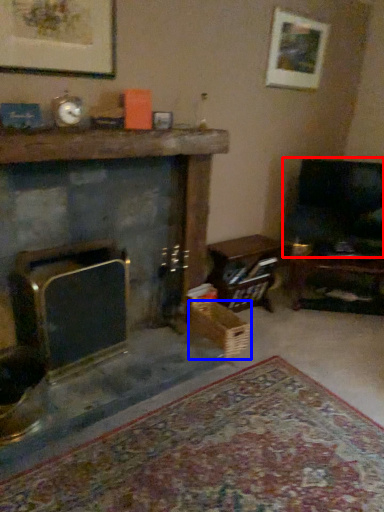
Question: Which of the following is the closest to the observer, rocking chair (highlighted by a red box) or crate (highlighted by a blue box)?

Choices:
 (A) rocking chair
 (B) crate

Answer: (B)